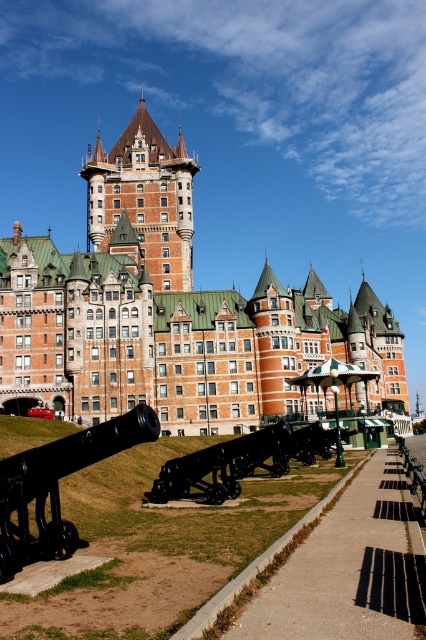
Question: Which object is closer to the camera taking this photo?

Choices:
 (A) wooden park bench at lower right
 (B) orange brick castle at center

Answer: (A)

Question: Can you confirm if orange brick castle at center is positioned to the right of black polished cannon at center?

Choices:
 (A) no
 (B) yes

Answer: (A)

Question: Is the position of concrete sidewalk at center more distant than that of black matte cannon at lower left?

Choices:
 (A) no
 (B) yes

Answer: (A)

Question: Considering the real-world distances, which object is closest to the orange brick tower at upper center?

Choices:
 (A) black polished cannon at center
 (B) black matte cannon at lower left

Answer: (A)

Question: Which of these objects is positioned farthest from the concrete sidewalk at center?

Choices:
 (A) orange brick tower at upper center
 (B) orange brick castle at center

Answer: (A)

Question: Is orange brick castle at center to the right of orange brick tower at upper center from the viewer's perspective?

Choices:
 (A) yes
 (B) no

Answer: (A)